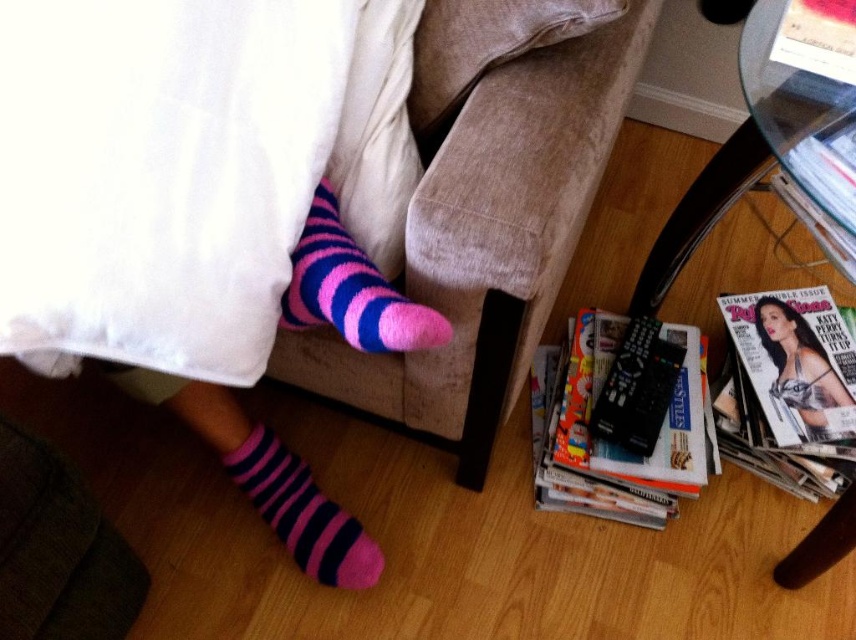
Question: Is pink striped sock at lower left positioned at the back of printed glossy magazine at lower right?

Choices:
 (A) no
 (B) yes

Answer: (A)

Question: Which point appears closest to the camera in this image?

Choices:
 (A) (318, 234)
 (B) (660, 481)
 (C) (336, 577)

Answer: (A)

Question: Where is suede-like beige couch at center located in relation to pink striped sock at lower left in the image?

Choices:
 (A) left
 (B) right

Answer: (B)

Question: Considering the real-world distances, which object is farthest from the pink striped sock at lower left?

Choices:
 (A) printed glossy magazine at lower right
 (B) suede-like beige couch at center

Answer: (A)

Question: Based on their relative distances, which object is nearer to the pink striped sock at lower left?

Choices:
 (A) suede-like beige couch at center
 (B) printed glossy magazine at lower right
 (C) pink fuzzy sock at center

Answer: (A)

Question: In this image, where is printed glossy magazine at lower right located relative to matte black magazine at lower right?

Choices:
 (A) above
 (B) below

Answer: (B)